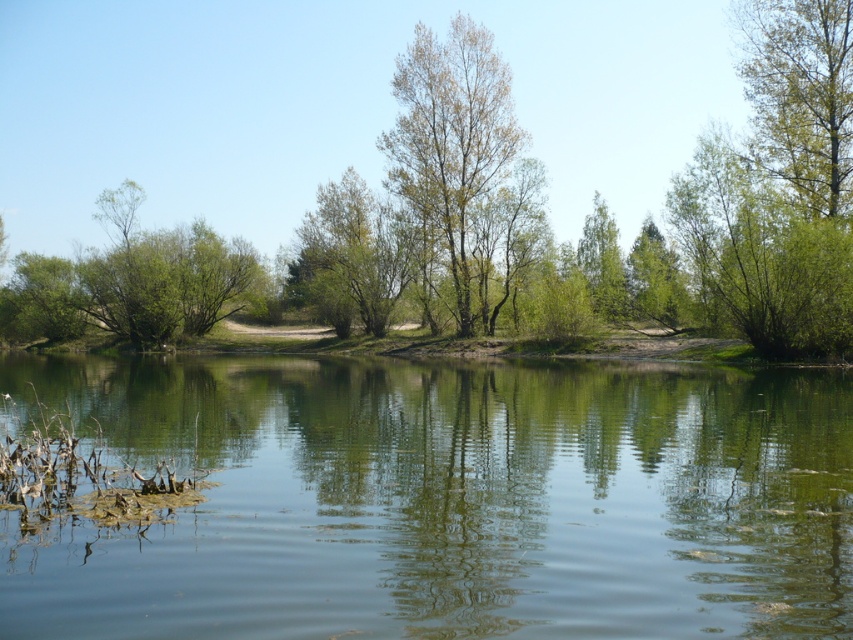
You are a photographer wanting to capture the entire green leafy bush at left and the green reflective water at center in a single frame. Given their sizes, will you need to adjust your camera angle to include both?

The green reflective water at center is wider than the green leafy bush at left, so you may need to zoom out or move back to ensure both fit in the frame.

You are standing at the edge of the water and want to reach the green leafy tree at center. Which direction should you walk to get there?

The green leafy tree at center is located at point [463,163], so you should walk towards the center of the image to reach it.

You are standing at the edge of the green reflective water at center and want to take a photo of the green leafy tree at upper right. Which direction should you move to frame the tree in your camera?

You should move to the right to frame the green leafy tree at upper right because the green reflective water at center is to the left of it.